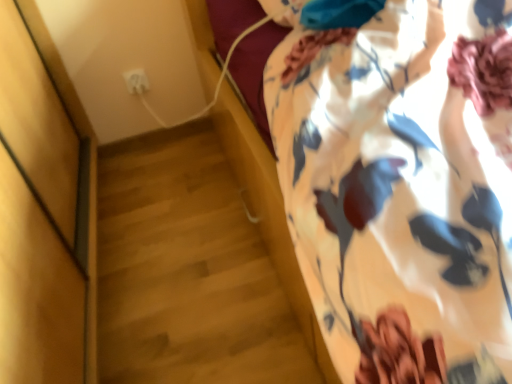
Locate an element on the screen. This screenshot has height=384, width=512. floral fabric curtain at upper right is located at coordinates (400, 181).

Describe the element at coordinates (400, 181) in the screenshot. I see `floral fabric curtain at upper right` at that location.

Locate an element on the screen. The width and height of the screenshot is (512, 384). white plastic outlet at upper left is located at coordinates (136, 81).

This screenshot has height=384, width=512. What do you see at coordinates (136, 81) in the screenshot?
I see `white plastic outlet at upper left` at bounding box center [136, 81].

I want to click on floral fabric curtain at upper right, so click(x=400, y=181).

Can you confirm if white plastic outlet at upper left is positioned to the right of floral fabric curtain at upper right?

Incorrect, white plastic outlet at upper left is not on the right side of floral fabric curtain at upper right.

Which object is further away from the camera taking this photo, white plastic outlet at upper left or floral fabric curtain at upper right?

white plastic outlet at upper left is more distant.

Does point (129, 77) appear closer or farther from the camera than point (413, 239)?

Point (129, 77) is positioned farther from the camera compared to point (413, 239).

From the image's perspective, is white plastic outlet at upper left above floral fabric curtain at upper right?

Indeed, from the image's perspective, white plastic outlet at upper left is shown above floral fabric curtain at upper right.

From a real-world perspective, is white plastic outlet at upper left physically above floral fabric curtain at upper right?

No, from a real-world perspective, white plastic outlet at upper left is not over floral fabric curtain at upper right

Is white plastic outlet at upper left wider or thinner than floral fabric curtain at upper right?

white plastic outlet at upper left is thinner than floral fabric curtain at upper right.

Considering the sizes of white plastic outlet at upper left and floral fabric curtain at upper right in the image, is white plastic outlet at upper left taller or shorter than floral fabric curtain at upper right?

Considering their sizes, white plastic outlet at upper left has less height than floral fabric curtain at upper right.

Which of these two, white plastic outlet at upper left or floral fabric curtain at upper right, is smaller?

Smaller between the two is white plastic outlet at upper left.

Is white plastic outlet at upper left surrounding floral fabric curtain at upper right?

No, white plastic outlet at upper left does not contain floral fabric curtain at upper right.

Is white plastic outlet at upper left positioned far away from floral fabric curtain at upper right?

Yes, white plastic outlet at upper left is far from floral fabric curtain at upper right.

Is white plastic outlet at upper left oriented away from floral fabric curtain at upper right?

No, white plastic outlet at upper left is not facing the opposite direction of floral fabric curtain at upper right.

Measure the distance from white plastic outlet at upper left to floral fabric curtain at upper right.

white plastic outlet at upper left and floral fabric curtain at upper right are 4.48 feet apart.

This screenshot has height=384, width=512. I want to click on electric outlet above the floral fabric curtain at upper right (from the image's perspective), so click(136, 81).

Can you confirm if floral fabric curtain at upper right is positioned to the left of white plastic outlet at upper left?

No, floral fabric curtain at upper right is not to the left of white plastic outlet at upper left.

Does floral fabric curtain at upper right lie behind white plastic outlet at upper left?

No, floral fabric curtain at upper right is closer to the viewer.

Is point (308, 178) closer or farther from the camera than point (128, 71)?

Point (308, 178).

From the image's perspective, would you say floral fabric curtain at upper right is shown under white plastic outlet at upper left?

Yes, from the image's perspective, floral fabric curtain at upper right is below white plastic outlet at upper left.

From a real-world perspective, is floral fabric curtain at upper right physically located above or below white plastic outlet at upper left?

Clearly, from a real-world perspective, floral fabric curtain at upper right is above white plastic outlet at upper left.

Can you confirm if floral fabric curtain at upper right is thinner than white plastic outlet at upper left?

No.

In terms of height, does floral fabric curtain at upper right look taller or shorter compared to white plastic outlet at upper left?

Clearly, floral fabric curtain at upper right is taller compared to white plastic outlet at upper left.

Considering the relative sizes of floral fabric curtain at upper right and white plastic outlet at upper left in the image provided, is floral fabric curtain at upper right bigger than white plastic outlet at upper left?

Indeed, floral fabric curtain at upper right has a larger size compared to white plastic outlet at upper left.

Based on the photo, is floral fabric curtain at upper right inside or outside of white plastic outlet at upper left?

floral fabric curtain at upper right cannot be found inside white plastic outlet at upper left.

Is floral fabric curtain at upper right positioned far away from white plastic outlet at upper left?

Absolutely, floral fabric curtain at upper right is distant from white plastic outlet at upper left.

Is floral fabric curtain at upper right looking in the opposite direction of white plastic outlet at upper left?

Yes, floral fabric curtain at upper right is facing away from white plastic outlet at upper left.

Locate an element on the screen. electric outlet that is above the floral fabric curtain at upper right (from the image's perspective) is located at coordinates (136, 81).

Where is `electric outlet on the left side of floral fabric curtain at upper right`? The width and height of the screenshot is (512, 384). electric outlet on the left side of floral fabric curtain at upper right is located at coordinates (136, 81).

Locate an element on the screen. This screenshot has width=512, height=384. electric outlet behind the floral fabric curtain at upper right is located at coordinates (136, 81).